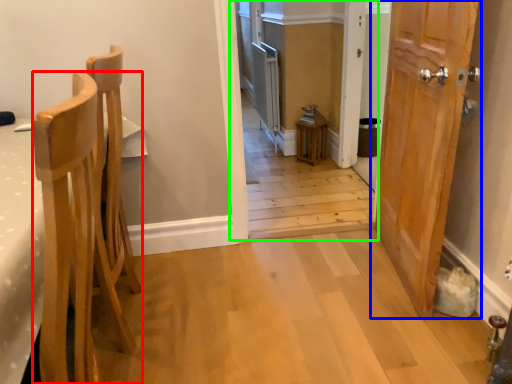
Question: Considering the real-world distances, which object is closest to chair (highlighted by a red box)? door (highlighted by a blue box) or corridor (highlighted by a green box).

Choices:
 (A) door
 (B) corridor

Answer: (A)